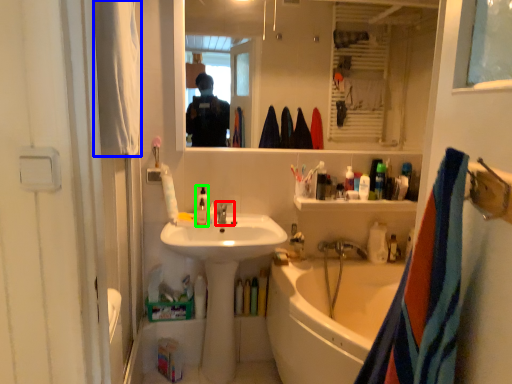
Question: Which is nearer to the faucet (highlighted by a red box)? towel/napkin (highlighted by a blue box) or bottle (highlighted by a green box).

Choices:
 (A) towel/napkin
 (B) bottle

Answer: (B)